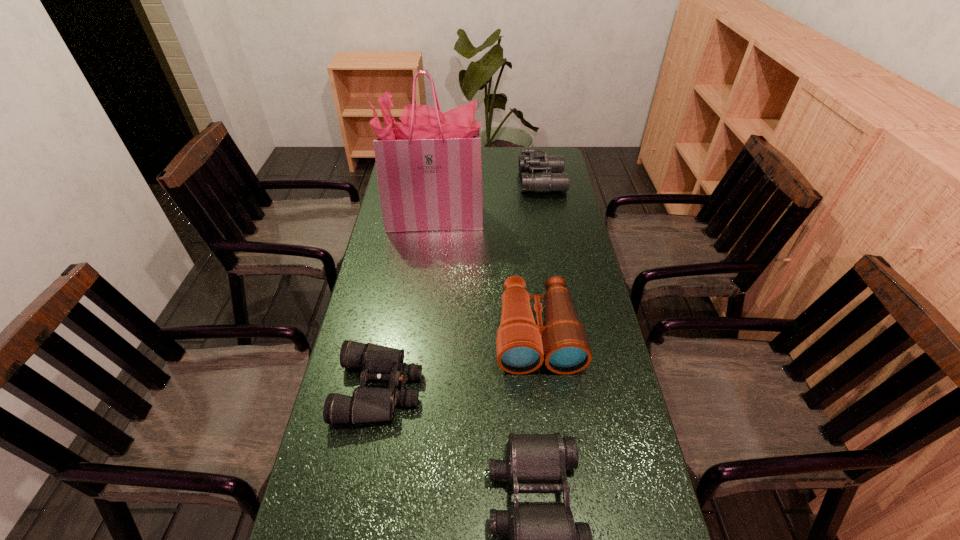
At what (x,y) coordinates should I click in order to perform the action: click on object that is positioned at the far edge. Please return your answer as a coordinate pair (x, y). This screenshot has width=960, height=540. Looking at the image, I should click on (539, 172).

Find the location of `shopping bag present at the left edge`. shopping bag present at the left edge is located at coordinates (429, 169).

At what (x,y) coordinates should I click in order to perform the action: click on binoculars that is at the left edge. Please return your answer as a coordinate pair (x, y). The width and height of the screenshot is (960, 540). Looking at the image, I should click on (379, 363).

Where is `object located at the far right corner`? object located at the far right corner is located at coordinates pyautogui.click(x=539, y=172).

Locate an element on the screen. free space at the far edge of the desktop is located at coordinates (507, 169).

You are a GUI agent. You are given a task and a screenshot of the screen. Output one action in this format:
    pyautogui.click(x=<x>, y=<y>)
    Task: Click on the vacant region at the left edge of the desktop
    This screenshot has width=960, height=540.
    Given the screenshot: What is the action you would take?
    pyautogui.click(x=398, y=331)

In the image, there is a desktop. Find the location of `vacant area at the right edge`. vacant area at the right edge is located at coordinates (584, 490).

The image size is (960, 540). Identify the location of free area in between the leftmost binoculars and the farthest binoculars. (461, 285).

At what (x,y) coordinates should I click in order to perform the action: click on vacant point located between the tallest object and the farthest binoculars. Please return your answer as a coordinate pair (x, y). This screenshot has width=960, height=540. Looking at the image, I should click on (487, 200).

Where is `object that is the second closest one to the third tallest binoculars`? The height and width of the screenshot is (540, 960). object that is the second closest one to the third tallest binoculars is located at coordinates (521, 346).